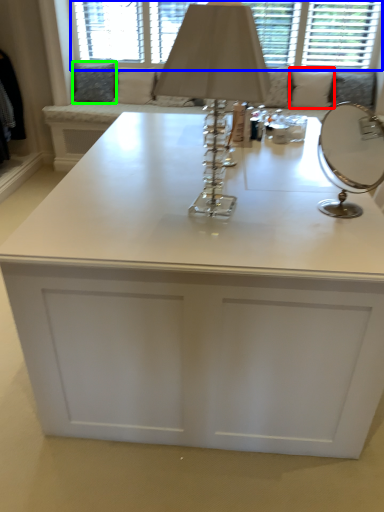
Question: Which object is the closest to the pillow (highlighted by a red box)? Choose among these: bay window (highlighted by a blue box) or pillow (highlighted by a green box).

Choices:
 (A) bay window
 (B) pillow

Answer: (A)